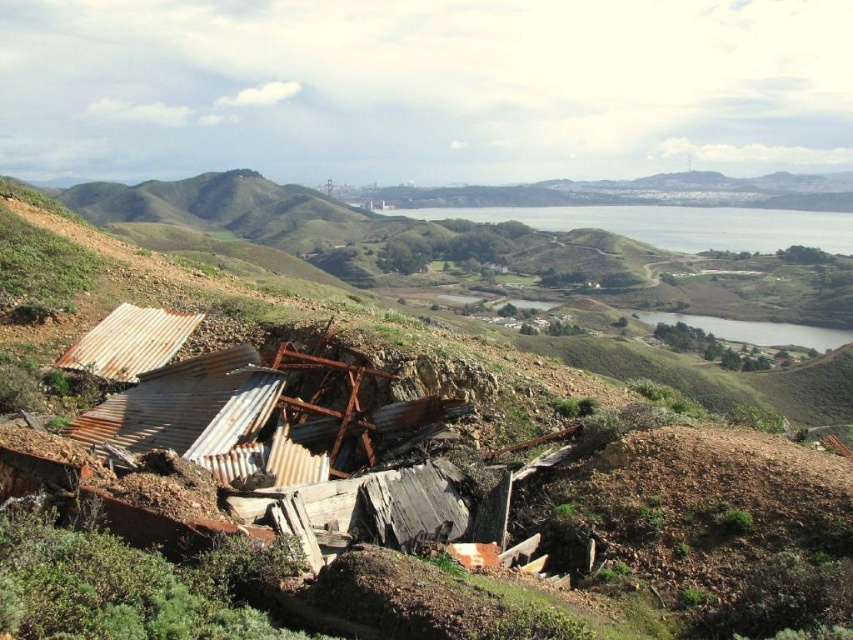
Between rusty corrugated metal at lower left and green grassy lake at center, which one appears on the right side from the viewer's perspective?

Positioned to the right is green grassy lake at center.

Where is `rusty corrugated metal at lower left`? The width and height of the screenshot is (853, 640). rusty corrugated metal at lower left is located at coordinates (708, 508).